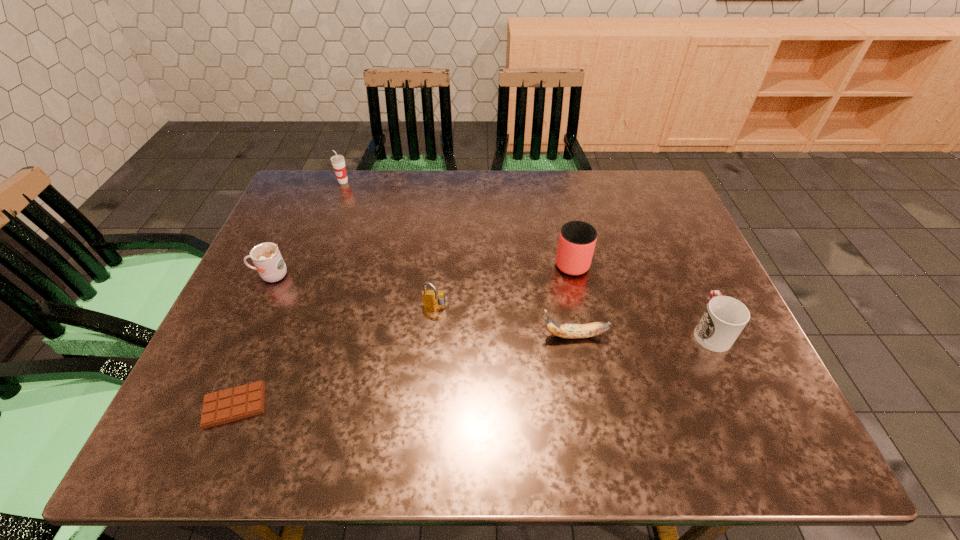
The image size is (960, 540). In order to click on vacant area at the left edge of the desktop in this screenshot , I will do `click(301, 275)`.

This screenshot has height=540, width=960. In order to click on free space at the right edge in this screenshot , I will do `click(680, 282)`.

Find the location of `vacant space at the far left corner of the desktop`. vacant space at the far left corner of the desktop is located at coordinates (323, 175).

Identify the location of vacant region between the nearest object and the padlock. (335, 356).

You are a GUI agent. You are given a task and a screenshot of the screen. Output one action in this format:
    pyautogui.click(x=<x>, y=<y>)
    Task: Click on the free spot between the farthest object and the banana
    Image resolution: width=960 pixels, height=540 pixels.
    Given the screenshot: What is the action you would take?
    [x=459, y=259]

Find the location of `free area in between the farthest cup and the rightmost cup`. free area in between the farthest cup and the rightmost cup is located at coordinates (527, 256).

Identify the location of empty location between the nearest object and the third cup from left to right. (403, 333).

The width and height of the screenshot is (960, 540). Find the location of `free point between the nearest cup and the farthest cup`. free point between the nearest cup and the farthest cup is located at coordinates click(x=527, y=256).

Find the location of a particular element. free spot between the second cup from right to left and the leftmost cup is located at coordinates (421, 268).

At what (x,y) coordinates should I click in order to perform the action: click on unoccupied position between the second cup from right to left and the nearest cup. Please return your answer as a coordinate pair (x, y). The image size is (960, 540). Looking at the image, I should click on (640, 295).